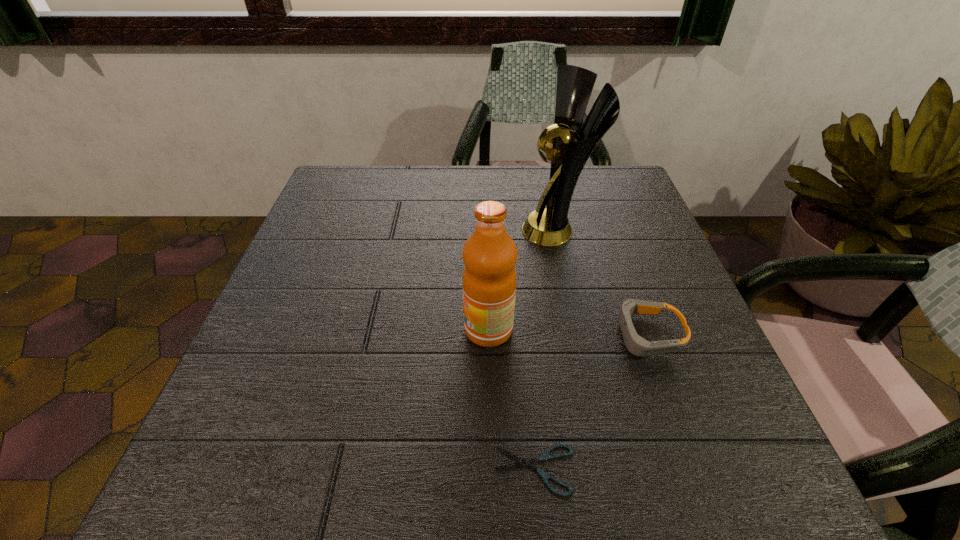
Where is `free space that satisfies the following two spatial constraints: 1. on the front and back of the third tallest object; 2. on the front side of the nearest object`? free space that satisfies the following two spatial constraints: 1. on the front and back of the third tallest object; 2. on the front side of the nearest object is located at coordinates (695, 470).